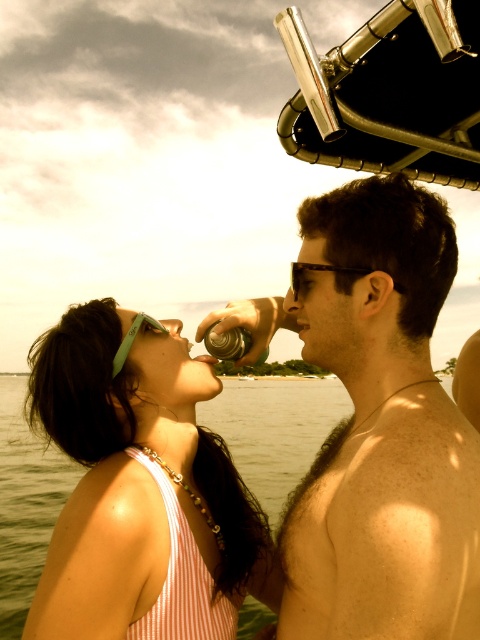
Based on the scene description, where is the clear water at center located in the image?

The clear water at center is located at point coordinates of (275, 429).